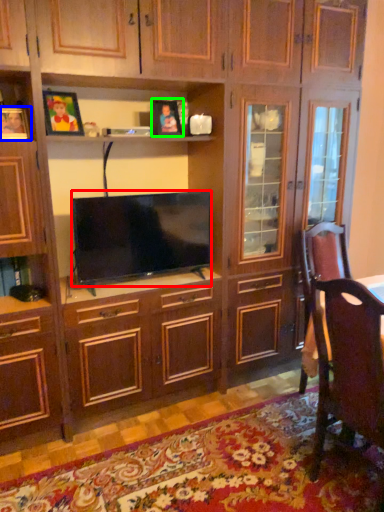
Question: Which is nearer to the television (highlighted by a red box)? picture frame (highlighted by a blue box) or picture frame (highlighted by a green box).

Choices:
 (A) picture frame
 (B) picture frame

Answer: (B)